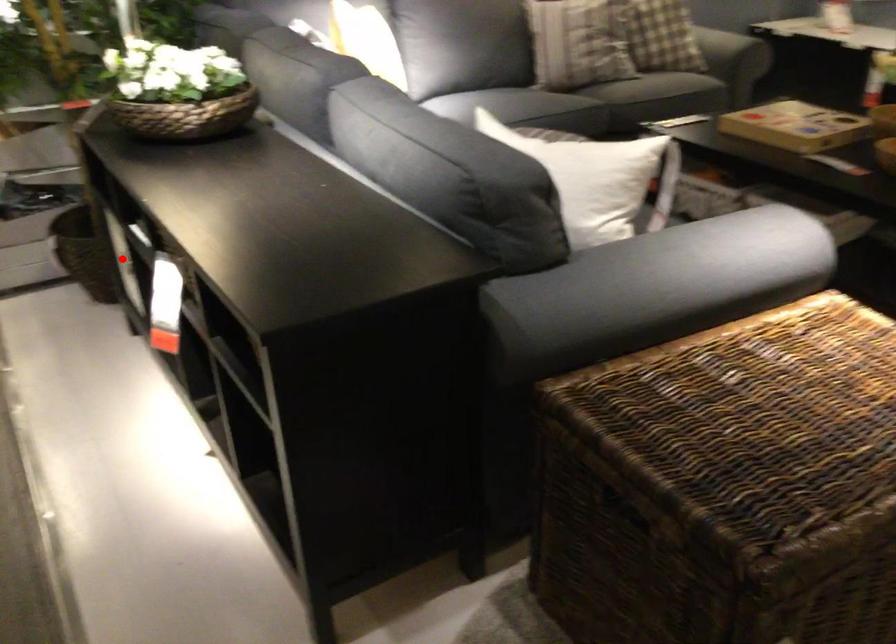
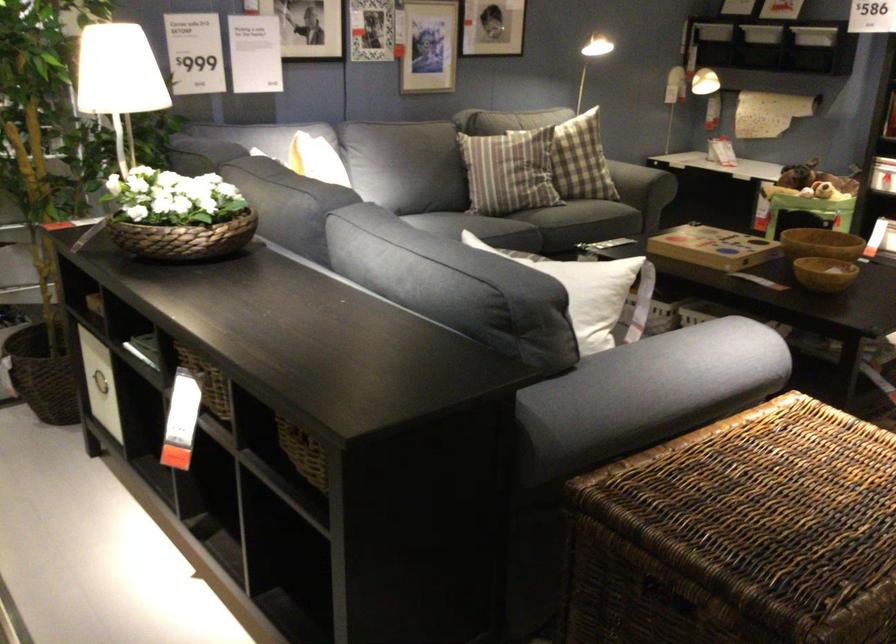
Find the pixel in the second image that matches the highlighted location in the first image.

(99, 383)